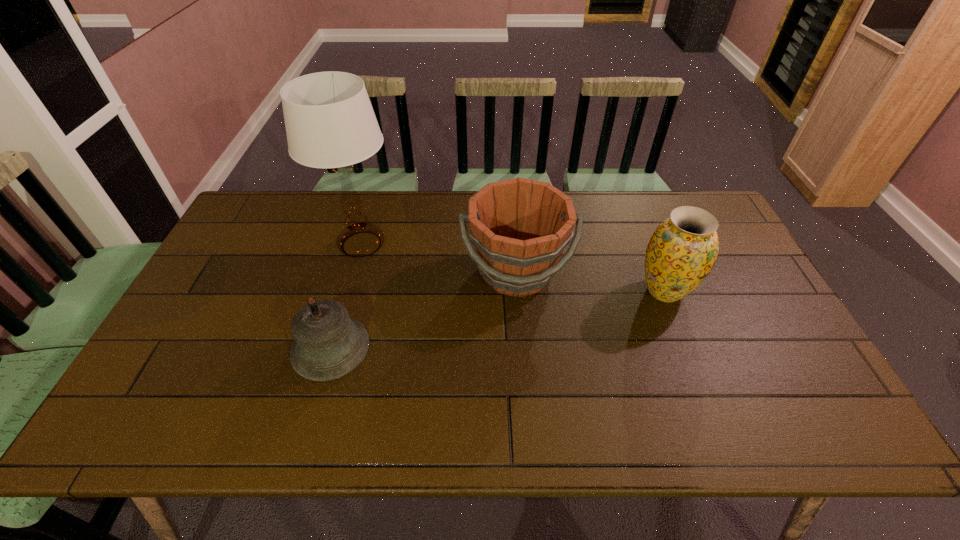
The image size is (960, 540). I want to click on free point between the tallest object and the nearest object, so click(x=347, y=296).

The image size is (960, 540). Find the location of `free spot between the bucket and the rightmost object`. free spot between the bucket and the rightmost object is located at coordinates (590, 281).

This screenshot has height=540, width=960. Find the location of `vacant region between the bucket and the bell`. vacant region between the bucket and the bell is located at coordinates coord(423,310).

This screenshot has height=540, width=960. I want to click on object that is the closest to the vase, so click(x=520, y=227).

Locate which object ranks in proximity to the third object from left to right. Please provide its 2D coordinates. Your answer should be formatted as a tuple, i.e. [(x, y)], where the tuple contains the x and y coordinates of a point satisfying the conditions above.

[(683, 249)]

I want to click on free space that satisfies the following two spatial constraints: 1. on the front-facing side of the table lamp; 2. on the right side of the vase, so click(348, 291).

What are the coordinates of `blank space that satisfies the following two spatial constraints: 1. on the handle side of the second object from right to left; 2. on the left side of the vase` in the screenshot? It's located at (518, 291).

This screenshot has height=540, width=960. In order to click on vacant space that satisfies the following two spatial constraints: 1. on the handle side of the vase; 2. on the left side of the bucket in this screenshot , I will do `click(518, 291)`.

Find the location of a particular element. vacant space that satisfies the following two spatial constraints: 1. on the handle side of the vase; 2. on the right side of the second object from right to left is located at coordinates (518, 291).